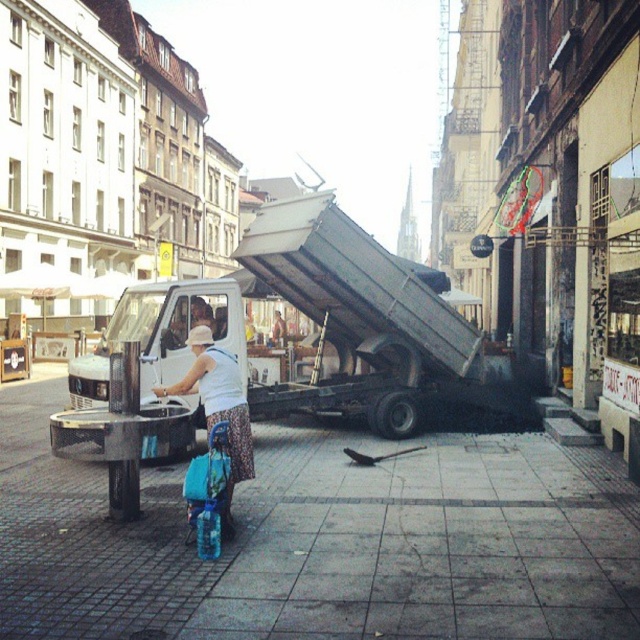
Question: Which object is closer to the camera taking this photo?

Choices:
 (A) white fabric dress at center
 (B) white matte truck at center

Answer: (A)

Question: Is the position of white matte truck at center less distant than that of white fabric dress at center?

Choices:
 (A) no
 (B) yes

Answer: (A)

Question: Is white matte truck at center positioned at the back of white fabric dress at center?

Choices:
 (A) no
 (B) yes

Answer: (B)

Question: Is white matte truck at center below white fabric dress at center?

Choices:
 (A) yes
 (B) no

Answer: (B)

Question: Among these points, which one is nearest to the camera?

Choices:
 (A) click(188, 285)
 (B) click(234, 413)

Answer: (B)

Question: Among these objects, which one is farthest from the camera?

Choices:
 (A) white matte truck at center
 (B) white fabric dress at center

Answer: (A)